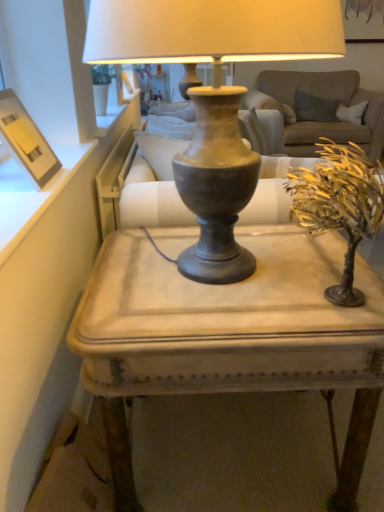
This screenshot has width=384, height=512. Find the location of `unoccupied space behind gold textured tree at right`. unoccupied space behind gold textured tree at right is located at coordinates (286, 242).